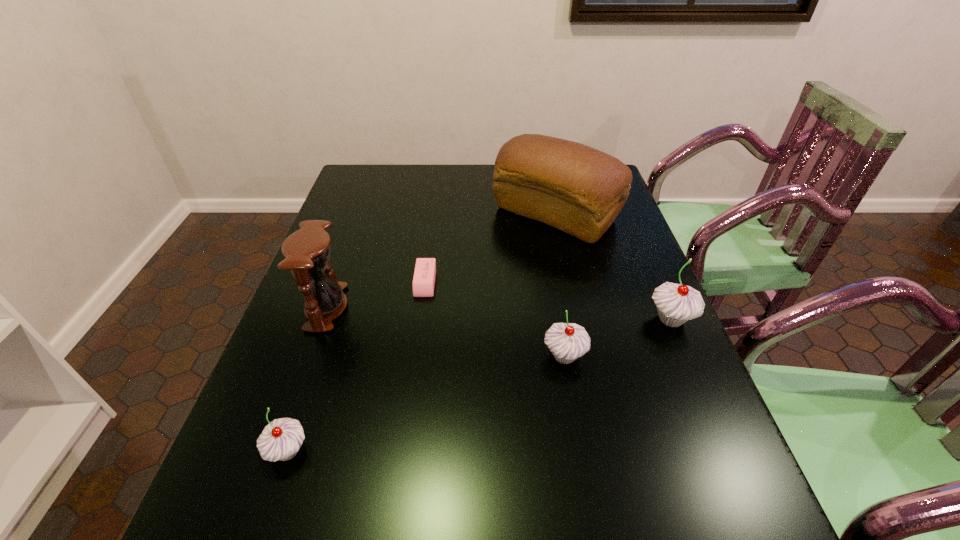
Where is `cupcake that is the second closest to the second tallest object`? This screenshot has height=540, width=960. cupcake that is the second closest to the second tallest object is located at coordinates (567, 341).

Locate an element on the screen. blank area in the image that satisfies the following two spatial constraints: 1. on the back side of the leftmost cupcake; 2. on the left side of the fourth object from right to left is located at coordinates (345, 282).

Locate an element on the screen. free region that satisfies the following two spatial constraints: 1. on the back side of the farthest object; 2. on the right side of the third shortest object is located at coordinates (540, 214).